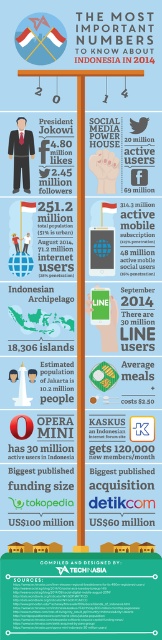
What is the relationship in height between the matte black mobile phone at center and the white glossy flag at center in the infographic?

The matte black mobile phone at center is taller than the white glossy flag at center.

You are standing at the point marked with coordinates (134, 262) in the image. There is another point 1.98 meters away from you. Can you reach it without moving your feet?

The other point is 1.98 meters away from the point marked with coordinates (134, 262). Since the distance is greater than an average person can reach without moving, you cannot reach it without moving your feet.